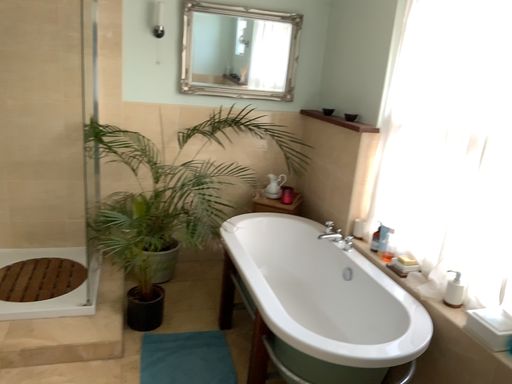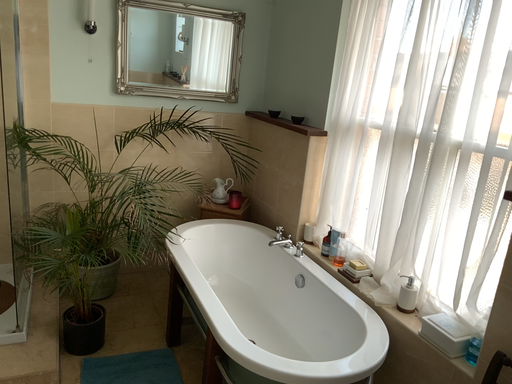
Question: How did the camera likely rotate when shooting the video?

Choices:
 (A) rotated right
 (B) rotated left

Answer: (A)